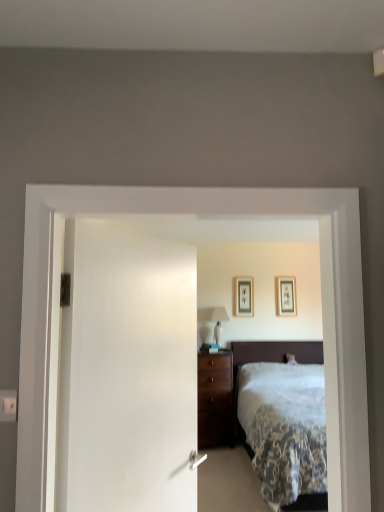
Question: Considering the positions of white glossy table lamp at center and matte black picture frame at center, which is the 1th picture frame in left-to-right order, in the image, is white glossy table lamp at center taller or shorter than matte black picture frame at center, which is the 1th picture frame in left-to-right order,?

Choices:
 (A) tall
 (B) short

Answer: (A)

Question: Based on their sizes in the image, would you say white glossy table lamp at center is bigger or smaller than matte black picture frame at center, which ranks as the 2th picture frame in right-to-left order?

Choices:
 (A) big
 (B) small

Answer: (A)

Question: Which object is the farthest from the white glossy table lamp at center?

Choices:
 (A) white soft bed at center
 (B) matte black picture frame at upper center, which is counted as the 1th picture frame, starting from the right
 (C) matte black picture frame at center, which is the 1th picture frame in left-to-right order
 (D) white plastic electric outlet at lower left

Answer: (D)

Question: Which of these objects is positioned closest to the matte black picture frame at center, which ranks as the 2th picture frame in right-to-left order?

Choices:
 (A) matte black picture frame at upper center, placed as the second picture frame when sorted from left to right
 (B) white glossy table lamp at center
 (C) white plastic electric outlet at lower left
 (D) white soft bed at center

Answer: (B)